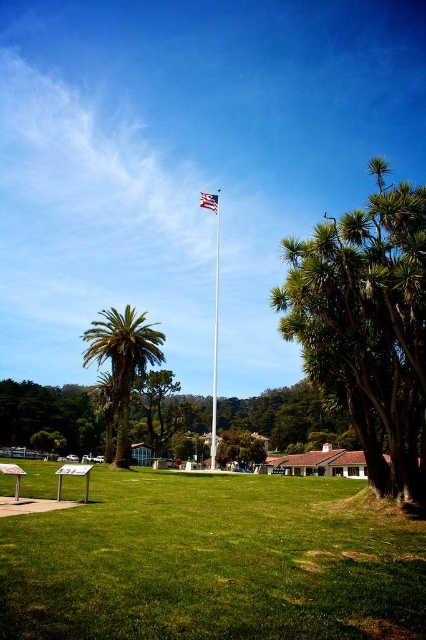
You are standing in the park and want to take a photo of the polished metal flag pole at center without the green leafy tree at right blocking it. Which direction should you move to ensure the tree is no longer in front of the flag pole?

Move to the left side of the green leafy tree at right so that the tree is no longer in front of the polished metal flag pole at center.

Based on the photo, you are standing in the park looking at the flagpole. Which tree, the green leafy tree at right or the green leafy palm tree at left, is nearer to you?

The green leafy tree at right is closer to the viewer than the green leafy palm tree at left.